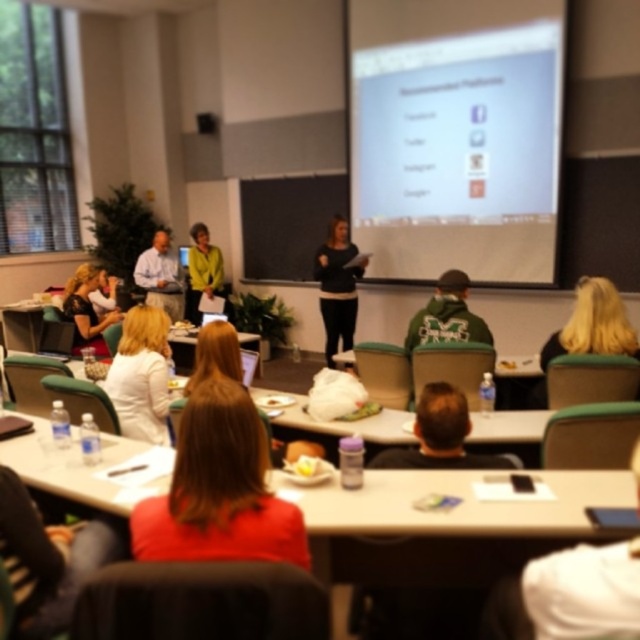
You are a photographer positioned at the back of the classroom. You want to take a photo of both the light blue shirt at center and the matte yellow shirt at center so that both are fully visible in the frame. Given their heights, which shirt should you focus on to ensure both are in focus?

The light blue shirt at center is shorter than the matte yellow shirt at center. To ensure both are in focus, focus on the matte yellow shirt at center since it is taller, allowing the shorter light blue shirt at center to also be within the depth of field.

You are a student sitting at the back of the classroom. Looking at the white plastic table at center and the blonde hair at upper right, which one is closer to the front of the classroom?

The white plastic table at center is below blonde hair at upper right, so the blonde hair at upper right is closer to the front of the classroom.

Based on the photo, you are seated at the back of the classroom and want to ask a question to the presenter wearing the white fabric shirt at center. Based on their position, can you estimate if they are facing towards the projection screen or away from it?

The white fabric shirt at center is located at point (141, 376), which is in the central area of the classroom. Since presenters typically face the projection screen to address the audience, it is likely that the presenter wearing the white fabric shirt at center is facing towards the projection screen.